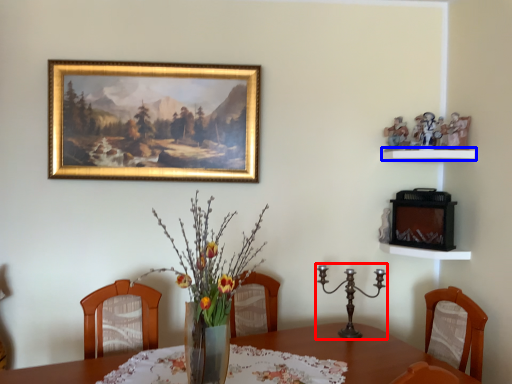
Question: Which of the following is the closest to the observer, candle holder (highlighted by a red box) or shelf (highlighted by a blue box)?

Choices:
 (A) candle holder
 (B) shelf

Answer: (A)